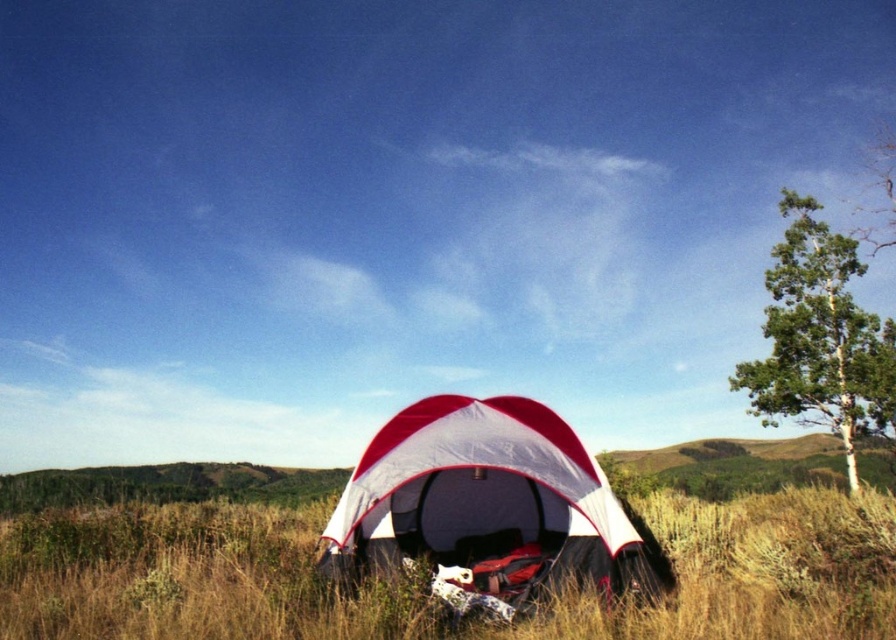
You are a hiker who wants to set up a tent in the camping area. You see the grassy field at center and the green smooth bark tree at right. Which location would be more suitable for setting up your tent to avoid the tree roots?

The grassy field at center is more suitable because it is in front of the green smooth bark tree at right, meaning it is farther away from the tree and its roots.

You are planning to set up a new tent in the camping area shown in the image. The current tent is located at the grassy field at center. Where exactly should you place your new tent if you want it to be positioned 2 meters north of the existing tent?

Since the grassy field at center is located at coordinates point (x=421, y=596), placing the new tent 2 meters north would require adjusting the y coordinate accordingly. However, without knowing the scale of the image, it is impossible to determine the exact pixel coordinates for the new position.